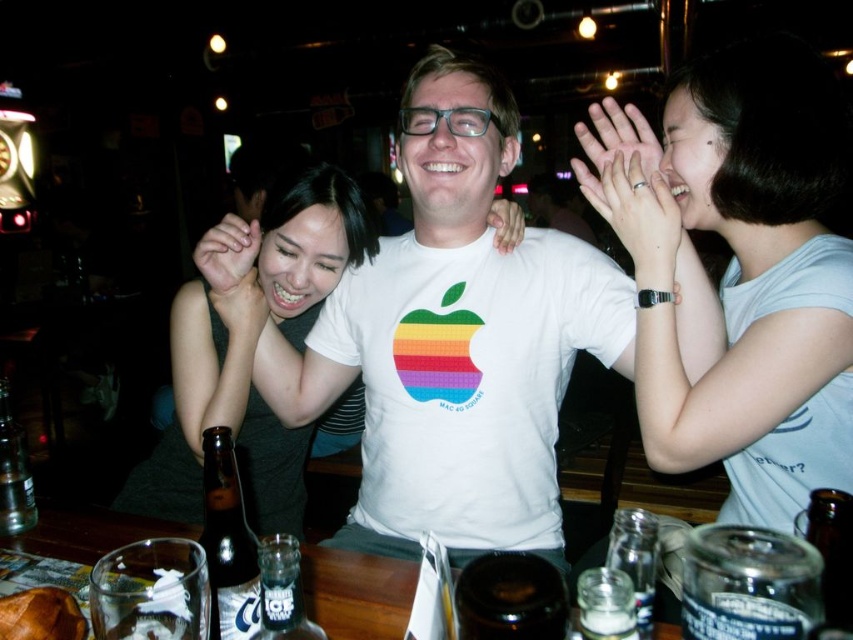
Question: Which of the following is the closest to the observer?

Choices:
 (A) pyautogui.click(x=250, y=250)
 (B) pyautogui.click(x=848, y=240)
 (C) pyautogui.click(x=241, y=593)
 (D) pyautogui.click(x=505, y=228)

Answer: (C)

Question: Can you confirm if white cotton shirt at upper center is positioned to the right of matte silver ring at upper center?

Choices:
 (A) no
 (B) yes

Answer: (B)

Question: Among these objects, which one is nearest to the camera?

Choices:
 (A) matte skin hand at center
 (B) matte white hand at center
 (C) matte white hand at upper center
 (D) white cotton shirt at upper center

Answer: (D)

Question: Is white cotton shirt at upper center thinner than brown glass bottle at lower left?

Choices:
 (A) no
 (B) yes

Answer: (A)

Question: In this image, where is brown glass bottle at lower left located relative to matte silver ring at upper center?

Choices:
 (A) right
 (B) left

Answer: (B)

Question: Which point is closer to the camera?

Choices:
 (A) matte white hand at center
 (B) matte white hand at upper center
 (C) brown glass bottle at lower left
 (D) white cotton shirt at upper center

Answer: (C)